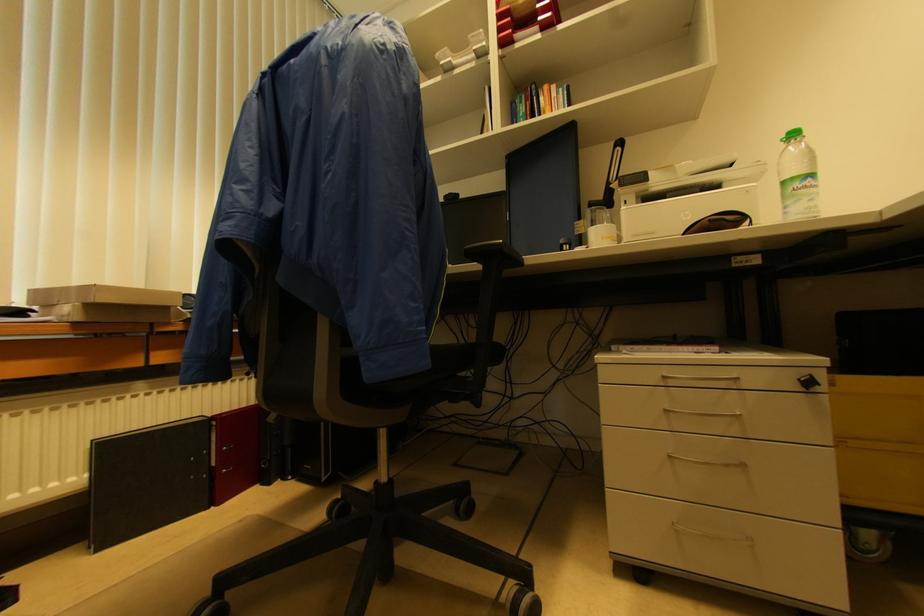
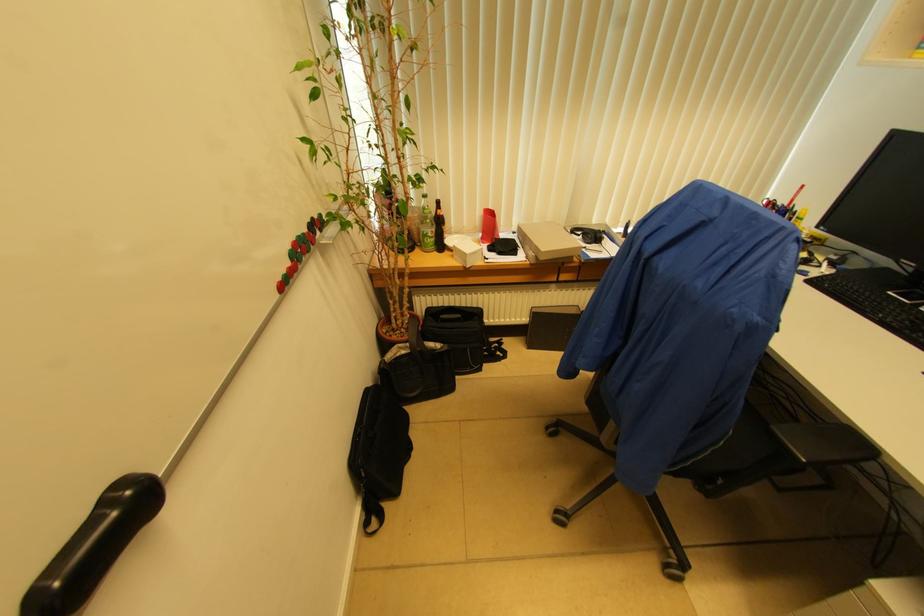
In the second image, find the point that corresponds to point (503, 241) in the first image.

(807, 461)